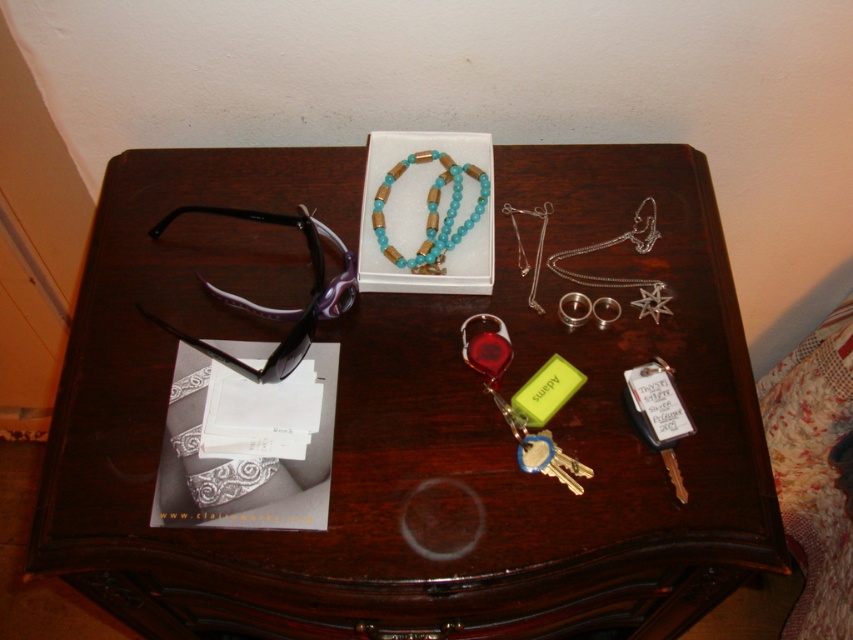
Is dark wood table at center smaller than translucent plastic keychain at center?

Incorrect, dark wood table at center is not smaller in size than translucent plastic keychain at center.

Is point (631, 308) more distant than point (543, 444)?

Yes, point (631, 308) is farther from viewer.

What are the coordinates of `dark wood table at center` in the screenshot? It's located at (412, 417).

Who is taller, translucent plastic keychain at center or turquoise beads necklace at center?

With more height is translucent plastic keychain at center.

Locate an element on the screen. translucent plastic keychain at center is located at coordinates (514, 408).

Who is more distant from viewer, (152,400) or (433,212)?

Positioned behind is point (433,212).

Between dark wood table at center and turquoise beads necklace at center, which one appears on the right side from the viewer's perspective?

turquoise beads necklace at center

The height and width of the screenshot is (640, 853). In order to click on dark wood table at center in this screenshot , I will do `click(412, 417)`.

Identify the location of dark wood table at center. The width and height of the screenshot is (853, 640). (412, 417).